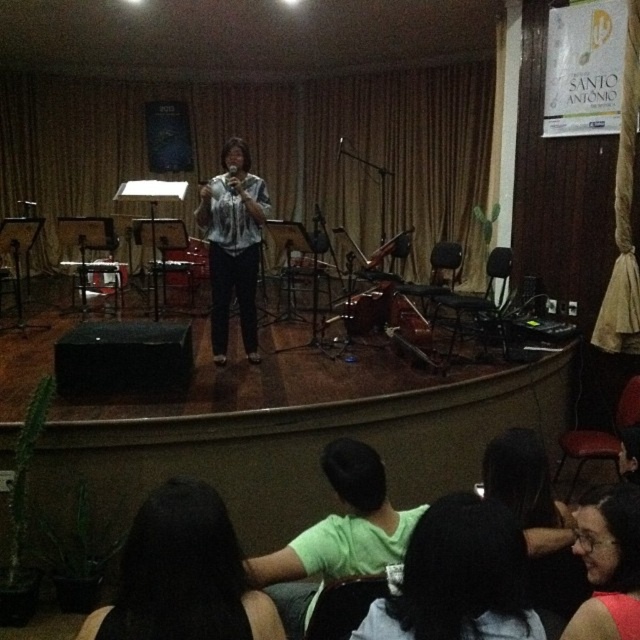
Is black matte shirt at center above matte black hair at center?

No.

The width and height of the screenshot is (640, 640). What are the coordinates of `black matte shirt at center` in the screenshot? It's located at (458, 577).

The image size is (640, 640). What are the coordinates of `black matte shirt at center` in the screenshot? It's located at (458, 577).

Consider the image. Does green matte shirt at lower center lie in front of matte black hair at center?

That is False.

Between point (394, 556) and point (580, 621), which one is positioned behind?

Positioned behind is point (394, 556).

Where is `green matte shirt at lower center`? The height and width of the screenshot is (640, 640). green matte shirt at lower center is located at coordinates (337, 536).

Describe the element at coordinates (337, 536) in the screenshot. This screenshot has height=640, width=640. I see `green matte shirt at lower center` at that location.

Is green matte shirt at lower center bigger than matte black microphone at center?

Yes, green matte shirt at lower center is bigger than matte black microphone at center.

Between point (348, 452) and point (493, 248), which one is positioned in front?

Point (348, 452)

Where is `green matte shirt at lower center`? The height and width of the screenshot is (640, 640). green matte shirt at lower center is located at coordinates (337, 536).